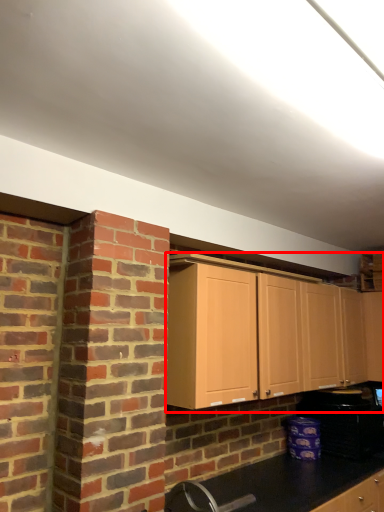
Question: Observing the image, what is the correct spatial positioning of cabinetry (annotated by the red box) in reference to appliance?

Choices:
 (A) left
 (B) right

Answer: (A)